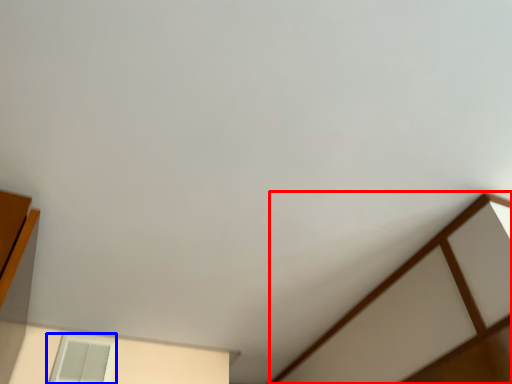
Question: Which of the following is the farthest to the observer, furniture (highlighted by a red box) or window (highlighted by a blue box)?

Choices:
 (A) furniture
 (B) window

Answer: (B)